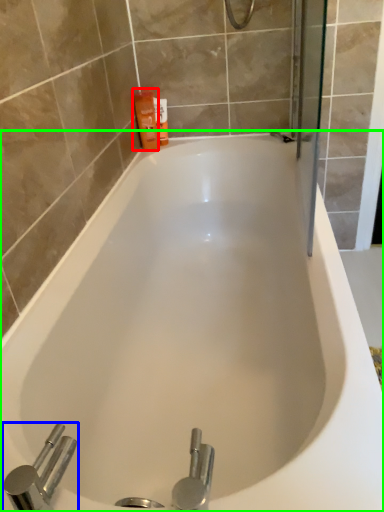
Question: Estimate the real-world distances between objects in this image. Which object is farther from toiletry (highlighted by a red box), tap (highlighted by a blue box) or bathtub (highlighted by a green box)?

Choices:
 (A) tap
 (B) bathtub

Answer: (A)